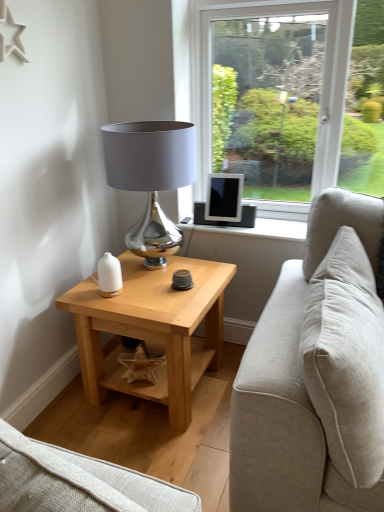
Locate an element on the screen. free space in front of shiny metallic lampshade at center is located at coordinates (150, 298).